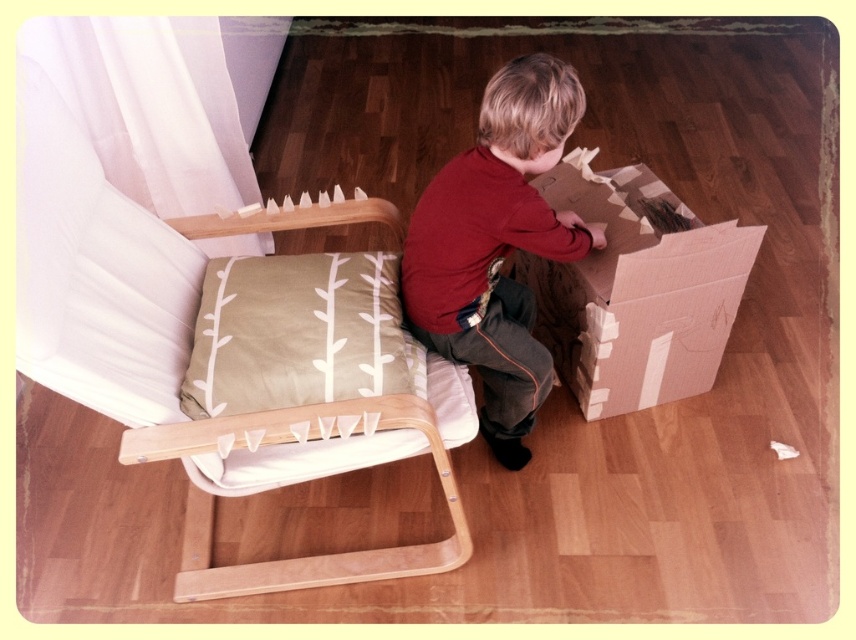
What do you see at coordinates (187, 355) in the screenshot? I see `wooden cushioned chair at center` at bounding box center [187, 355].

Where is `wooden cushioned chair at center`? The image size is (856, 640). wooden cushioned chair at center is located at coordinates (187, 355).

Measure the distance from red cotton shirt at center to cardboard box at lower right.

A distance of 9.35 inches exists between red cotton shirt at center and cardboard box at lower right.

In the scene shown: Which is below, red cotton shirt at center or cardboard box at lower right?

red cotton shirt at center

The width and height of the screenshot is (856, 640). In order to click on red cotton shirt at center in this screenshot , I will do `click(496, 244)`.

Identify the location of red cotton shirt at center. (496, 244).

Which is behind, point (378, 218) or point (688, 236)?

Positioned behind is point (378, 218).

Does point (147, 333) lie behind point (700, 355)?

That is False.

The height and width of the screenshot is (640, 856). In order to click on wooden cushioned chair at center in this screenshot , I will do `click(187, 355)`.